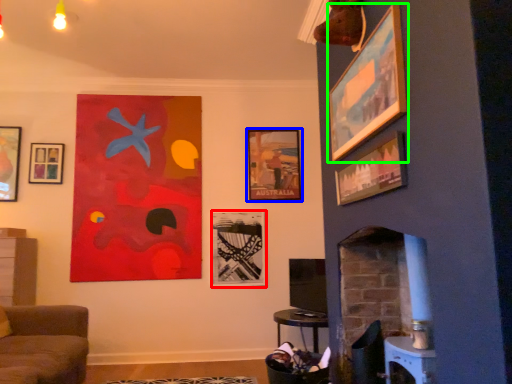
Question: Which object is positioned closest to picture frame (highlighted by a red box)? Select from picture frame (highlighted by a blue box) and picture frame (highlighted by a green box).

Choices:
 (A) picture frame
 (B) picture frame

Answer: (A)